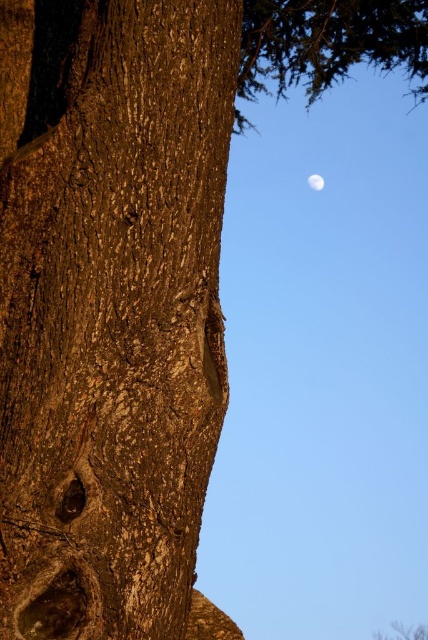
Is rough bark tree trunk at left taller than rough bark tree at upper left?

Yes, rough bark tree trunk at left is taller than rough bark tree at upper left.

Which is behind, point (92, 557) or point (413, 637)?

The point (413, 637) is behind.

Between point (62, 36) and point (403, 630), which one is positioned behind?

Positioned behind is point (403, 630).

This screenshot has height=640, width=428. Find the location of `rough bark tree trunk at left`. rough bark tree trunk at left is located at coordinates (110, 310).

Looking at this image, between rough bark tree at upper left and white matte moon at upper right, which one is positioned higher?

white matte moon at upper right

Does rough bark tree at upper left have a lesser width compared to white matte moon at upper right?

No, rough bark tree at upper left is not thinner than white matte moon at upper right.

Is point (421, 632) more distant than point (318, 179)?

No, it is not.

This screenshot has width=428, height=640. I want to click on rough bark tree at upper left, so click(404, 632).

Is rough bark tree trunk at left further to the viewer compared to white matte moon at upper right?

No.

Who is more forward, (113, 460) or (312, 182)?

Point (113, 460)

Which is in front, point (71, 266) or point (320, 182)?

Point (71, 266) is in front.

Identify the location of rough bark tree trunk at left. The width and height of the screenshot is (428, 640). (110, 310).